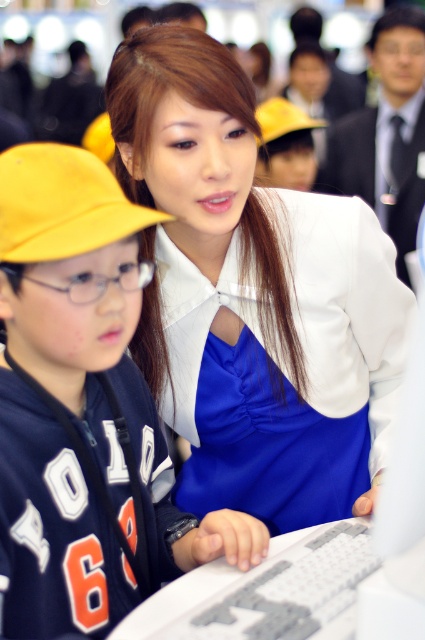
Question: Can you confirm if matte yellow cap at left is positioned to the left of yellow fabric baseball hat at left?

Choices:
 (A) no
 (B) yes

Answer: (A)

Question: Does matte yellow cap at left have a larger size compared to yellow fabric baseball hat at left?

Choices:
 (A) yes
 (B) no

Answer: (A)

Question: Which point is farther from the camera taking this photo?

Choices:
 (A) tap(23, 230)
 (B) tap(70, 244)
 (C) tap(246, 93)

Answer: (C)

Question: Which is nearer to the yellow fabric baseball hat at left?

Choices:
 (A) matte yellow cap at left
 (B) satin blue dress at center

Answer: (A)

Question: Estimate the real-world distances between objects in this image. Which object is closer to the satin blue dress at center?

Choices:
 (A) yellow fabric baseball hat at left
 (B) matte yellow cap at left

Answer: (B)

Question: Can you confirm if satin blue dress at center is positioned below yellow fabric baseball hat at left?

Choices:
 (A) no
 (B) yes

Answer: (B)